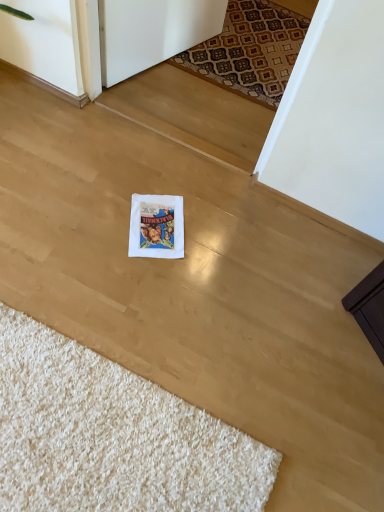
Where is `empty space that is to the right of white shaggy rug at lower left`? The width and height of the screenshot is (384, 512). empty space that is to the right of white shaggy rug at lower left is located at coordinates (300, 400).